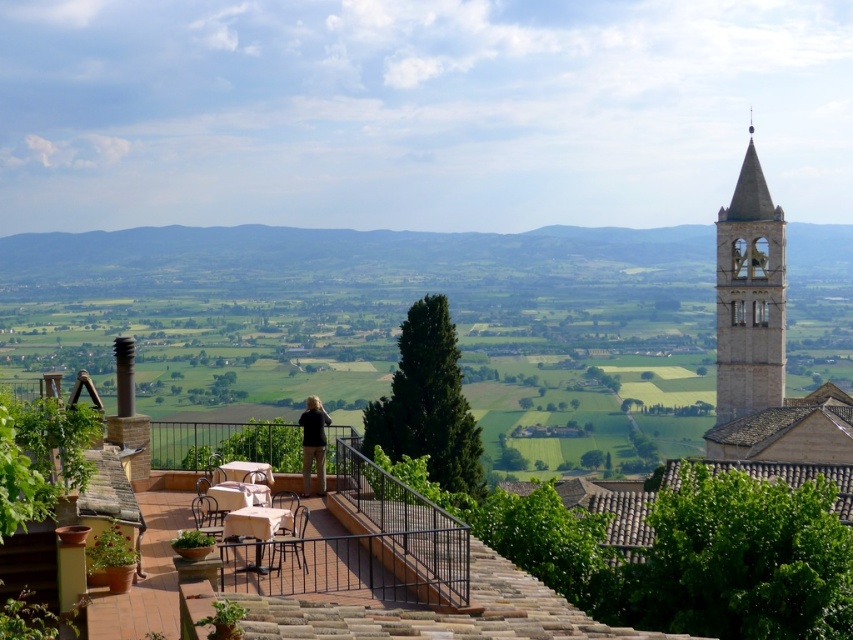
You are standing on a terrace overlooking a valley and want to move closer to the metallic brown chair at lower center. How many steps would you need to take to reach it if each step covers approximately 2.5 feet?

The metallic brown chair at lower center is 156.85 feet away. Dividing the distance by the step length of 2.5 feet gives approximately 62.74 steps. Since you can only take whole steps, you would need to take 63 steps to reach the metallic brown chair at lower center.

You are a guest at this terrace and want to place a tall flower vase on the table that is taller. Which table should you choose between the metallic silver table at lower center and the wooden table at center?

The wooden table at center is taller than the metallic silver table at lower center, so you should choose the wooden table at center to place the tall flower vase.